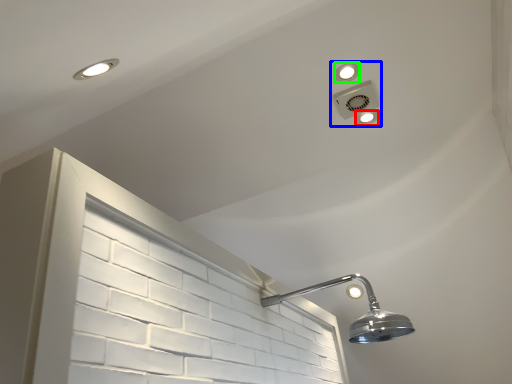
Question: Which is farther away from dot (highlighted by a red box)? fixture (highlighted by a blue box) or dot (highlighted by a green box)?

Choices:
 (A) fixture
 (B) dot

Answer: (B)